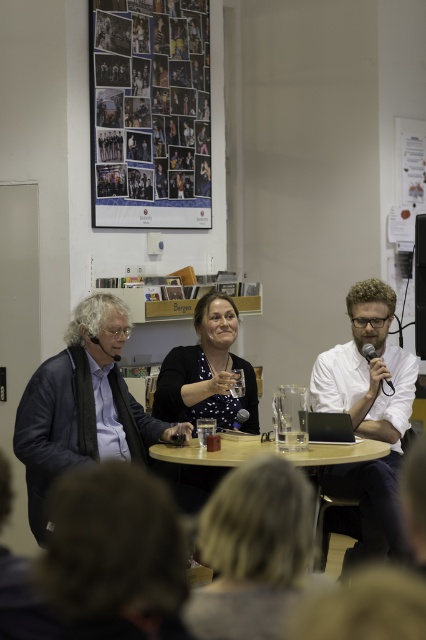
Which of these two, dark blue suit at left or polka dot blouse at center, stands taller?

dark blue suit at left is taller.

Does point (77, 332) come farther from viewer compared to point (227, 381)?

No, (77, 332) is in front of (227, 381).

Find the location of a particular element. dark blue suit at left is located at coordinates (83, 406).

Which of these two, dark blue suit at left or black matte laptop at center, stands shorter?

With less height is black matte laptop at center.

Between point (43, 444) and point (311, 435), which one is positioned behind?

The point (311, 435) is behind.

The image size is (426, 640). Describe the element at coordinates (83, 406) in the screenshot. I see `dark blue suit at left` at that location.

At what (x,y) coordinates should I click in order to perform the action: click on dark blue suit at left. Please return your answer as a coordinate pair (x, y). Looking at the image, I should click on (83, 406).

Does matte paper collage at upper left lie behind wooden table at center?

Yes, matte paper collage at upper left is further from the viewer.

Between matte paper collage at upper left and wooden table at center, which one appears on the right side from the viewer's perspective?

From the viewer's perspective, wooden table at center appears more on the right side.

Is point (192, 176) positioned after point (255, 444)?

That is True.

In order to click on matte paper collage at upper left in this screenshot , I will do (x=149, y=113).